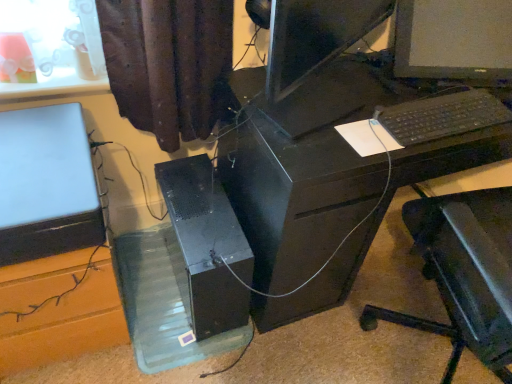
Question: Is matte black monitor at center facing away from black plastic desk at center?

Choices:
 (A) yes
 (B) no

Answer: (B)

Question: Is matte black monitor at center closer to the viewer compared to black plastic desk at center?

Choices:
 (A) no
 (B) yes

Answer: (A)

Question: Is matte black monitor at center far away from black plastic desk at center?

Choices:
 (A) yes
 (B) no

Answer: (B)

Question: Does matte black monitor at center appear on the left side of black plastic desk at center?

Choices:
 (A) no
 (B) yes

Answer: (A)

Question: Does matte black monitor at center contain black plastic desk at center?

Choices:
 (A) yes
 (B) no

Answer: (B)

Question: Looking at the image, does matte black monitor at center seem bigger or smaller compared to black plastic keyboard at right?

Choices:
 (A) small
 (B) big

Answer: (B)

Question: Is matte black monitor at center wider or thinner than black plastic keyboard at right?

Choices:
 (A) thin
 (B) wide

Answer: (B)

Question: Is matte black monitor at center in front of or behind black plastic keyboard at right in the image?

Choices:
 (A) behind
 (B) front

Answer: (A)

Question: From a real-world perspective, is matte black monitor at center positioned above or below black plastic keyboard at right?

Choices:
 (A) below
 (B) above

Answer: (B)

Question: From a real-world perspective, relative to black plastic desk at center, is black plastic keyboard at right vertically above or below?

Choices:
 (A) below
 (B) above

Answer: (B)

Question: From the image's perspective, relative to black plastic desk at center, is black plastic keyboard at right above or below?

Choices:
 (A) below
 (B) above

Answer: (B)

Question: Looking at the image, does black plastic keyboard at right seem bigger or smaller compared to black plastic desk at center?

Choices:
 (A) small
 (B) big

Answer: (A)

Question: In terms of width, does black plastic keyboard at right look wider or thinner when compared to black plastic desk at center?

Choices:
 (A) wide
 (B) thin

Answer: (B)

Question: Is satin black laptop at left inside or outside of transparent plastic glass box at lower center?

Choices:
 (A) outside
 (B) inside

Answer: (A)

Question: Considering the positions of point (67, 180) and point (168, 271), is point (67, 180) closer or farther from the camera than point (168, 271)?

Choices:
 (A) closer
 (B) farther

Answer: (A)